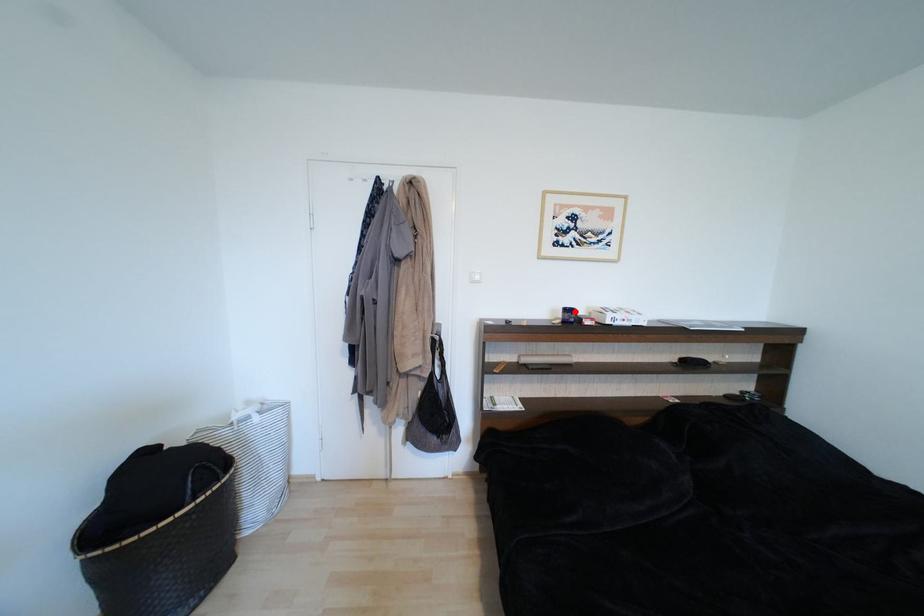
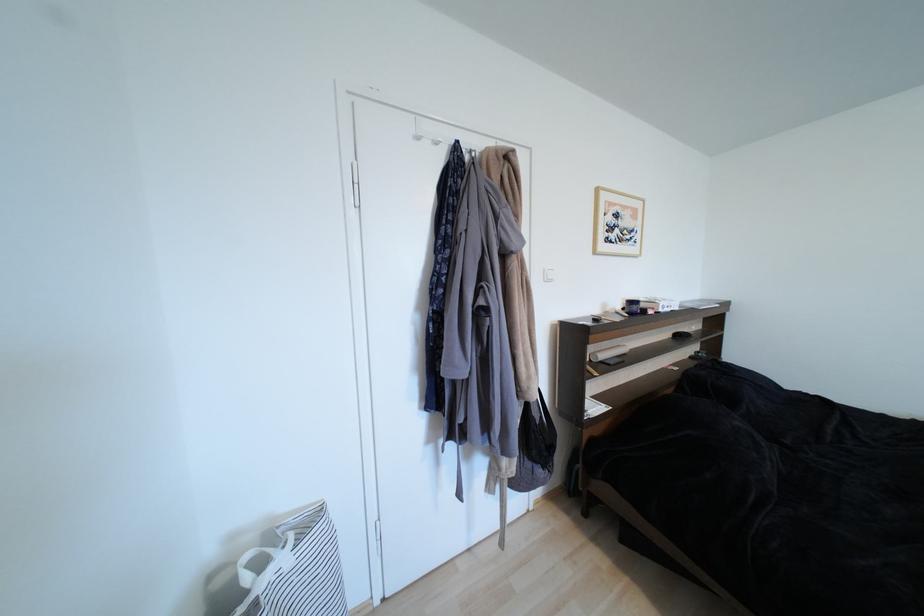
Find the pixel in the second image that matches the highlighted location in the first image.

(638, 304)